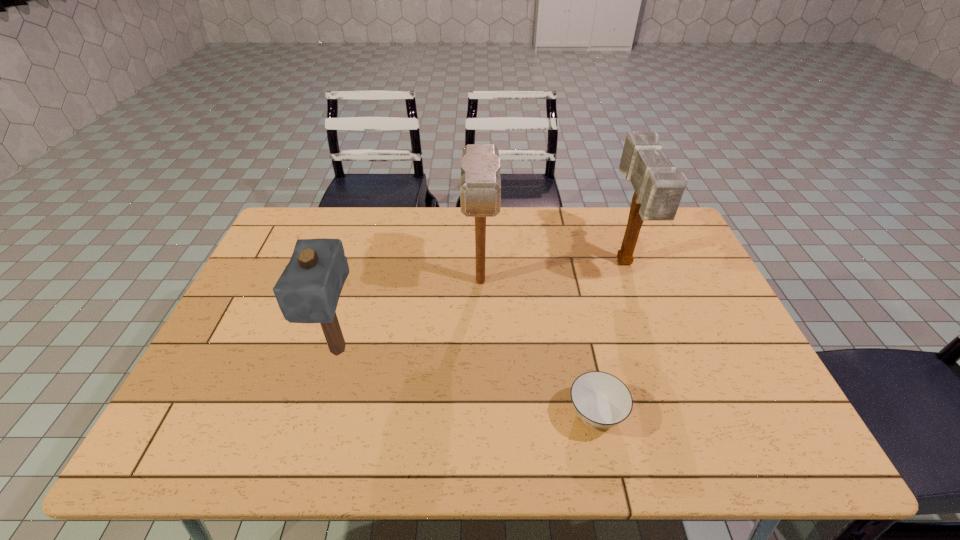
Identify the location of object that is at the far edge. (658, 189).

The height and width of the screenshot is (540, 960). Find the location of `object at the near edge`. object at the near edge is located at coordinates (601, 400).

Identify the location of vacant point at the far edge. The height and width of the screenshot is (540, 960). (614, 221).

At what (x,y) coordinates should I click in order to perform the action: click on free space at the near edge of the desktop. Please return your answer as a coordinate pair (x, y). The height and width of the screenshot is (540, 960). Looking at the image, I should click on (482, 433).

I want to click on blank area at the right edge, so click(x=696, y=377).

The height and width of the screenshot is (540, 960). What are the coordinates of `vacant space at the far right corner` in the screenshot? It's located at pos(660,238).

I want to click on vacant space that is in between the shortest mallet and the third object from left to right, so click(467, 382).

The width and height of the screenshot is (960, 540). Find the location of `unoccupied position between the shortest object and the second mallet from right to left`. unoccupied position between the shortest object and the second mallet from right to left is located at coordinates [538, 348].

The image size is (960, 540). I want to click on unoccupied position between the soup bowl and the rightmost object, so click(610, 339).

Locate an element on the screen. empty space that is in between the rightmost object and the third tallest object is located at coordinates (481, 307).